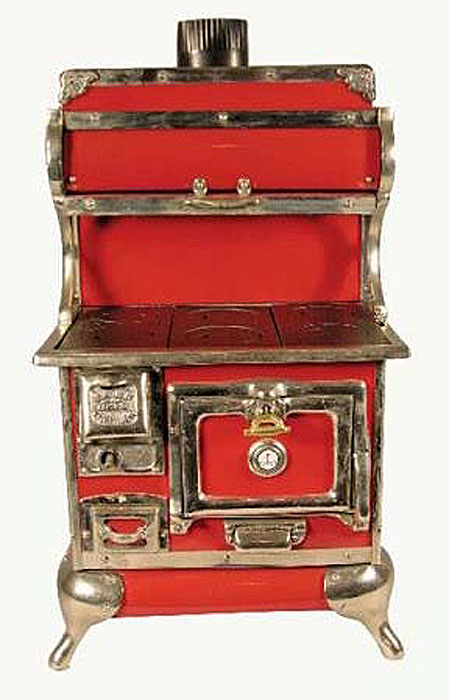
The image size is (449, 700). I want to click on oven, so click(409, 449), click(269, 414).